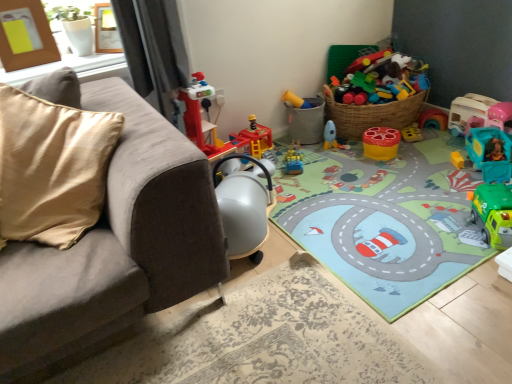
At what (x,y) coordinates should I click in order to perform the action: click on unoccupied space behind green plastic toy car at lower right, the 4th toy in the left-to-right sequence. Please return your answer as a coordinate pair (x, y). Looking at the image, I should click on (450, 201).